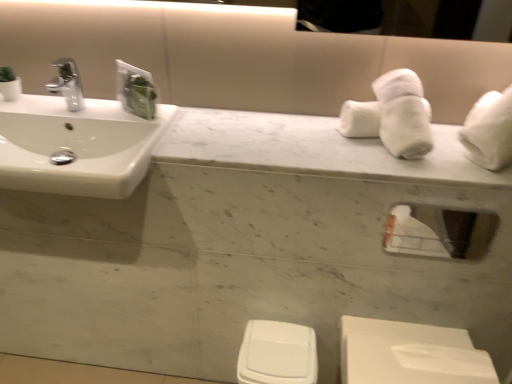
Question: From the image's perspective, is clear glass mirror at upper right located beneath white glossy sink at left?

Choices:
 (A) no
 (B) yes

Answer: (B)

Question: Does clear glass mirror at upper right appear on the right side of white glossy sink at left?

Choices:
 (A) yes
 (B) no

Answer: (A)

Question: From a real-world perspective, is clear glass mirror at upper right physically above white glossy sink at left?

Choices:
 (A) no
 (B) yes

Answer: (A)

Question: Does clear glass mirror at upper right come behind white glossy sink at left?

Choices:
 (A) no
 (B) yes

Answer: (B)

Question: Does clear glass mirror at upper right have a greater width compared to white glossy sink at left?

Choices:
 (A) yes
 (B) no

Answer: (B)

Question: Based on their sizes in the image, would you say white plastic toilet bowl at lower center is bigger or smaller than white marble counter top at center?

Choices:
 (A) big
 (B) small

Answer: (B)

Question: In the image, is white plastic toilet bowl at lower center positioned in front of or behind white marble counter top at center?

Choices:
 (A) behind
 (B) front

Answer: (A)

Question: From the image's perspective, relative to white marble counter top at center, is white plastic toilet bowl at lower center above or below?

Choices:
 (A) above
 (B) below

Answer: (B)

Question: From their relative heights in the image, would you say white plastic toilet bowl at lower center is taller or shorter than white marble counter top at center?

Choices:
 (A) short
 (B) tall

Answer: (B)

Question: Would you say clear glass mirror at upper right is inside or outside white marble counter top at center?

Choices:
 (A) outside
 (B) inside

Answer: (A)

Question: Is clear glass mirror at upper right in front of or behind white marble counter top at center in the image?

Choices:
 (A) behind
 (B) front

Answer: (A)

Question: Does point (490, 235) appear closer or farther from the camera than point (381, 158)?

Choices:
 (A) closer
 (B) farther

Answer: (A)

Question: From the image's perspective, relative to white marble counter top at center, is clear glass mirror at upper right above or below?

Choices:
 (A) below
 (B) above

Answer: (A)

Question: Considering the relative positions of white plastic toilet bowl at lower center and white glossy sink at left in the image provided, is white plastic toilet bowl at lower center to the left or to the right of white glossy sink at left?

Choices:
 (A) right
 (B) left

Answer: (A)

Question: From a real-world perspective, is white plastic toilet bowl at lower center positioned above or below white glossy sink at left?

Choices:
 (A) below
 (B) above

Answer: (A)